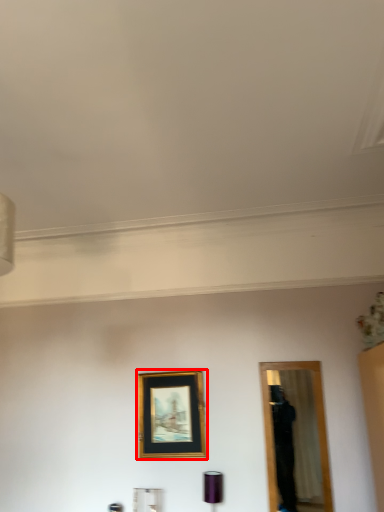
Question: From the image's perspective, what is the correct spatial relationship of picture frame (annotated by the red box) in relation to lamp?

Choices:
 (A) below
 (B) above

Answer: (B)